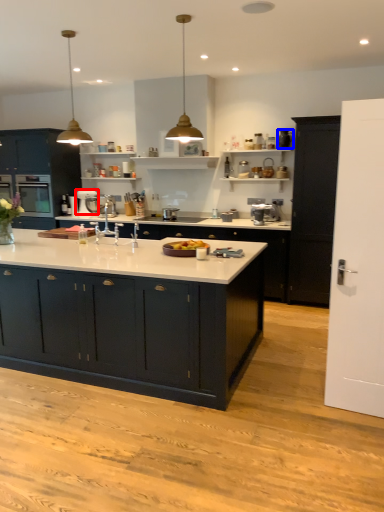
Question: Among these objects, which one is nearest to the camera, appliance (highlighted by a red box) or appliance (highlighted by a blue box)?

Choices:
 (A) appliance
 (B) appliance

Answer: (B)